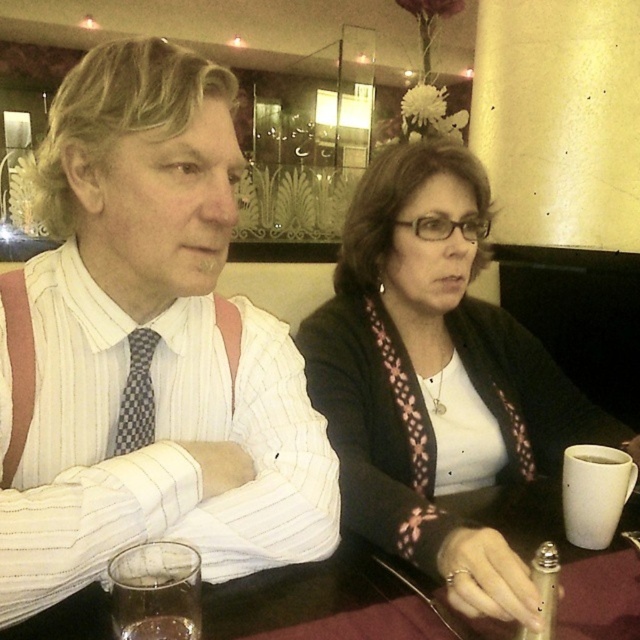
Question: Which point is closer to the camera?

Choices:
 (A) (369, 364)
 (B) (58, 436)
 (C) (134, 328)

Answer: (B)

Question: Does white striped shirt at center appear over translucent glass at lower left?

Choices:
 (A) no
 (B) yes

Answer: (B)

Question: Does white matte sweater at center appear over translucent glass at lower left?

Choices:
 (A) yes
 (B) no

Answer: (A)

Question: Which of the following is the farthest from the observer?

Choices:
 (A) translucent glass at lower left
 (B) white striped shirt at center

Answer: (B)

Question: Which point is closer to the camera?

Choices:
 (A) translucent glass at lower left
 (B) white matte sweater at center
 (C) checkered fabric tie at left

Answer: (A)

Question: Does white striped shirt at center appear on the left side of translucent glass at lower left?

Choices:
 (A) yes
 (B) no

Answer: (A)